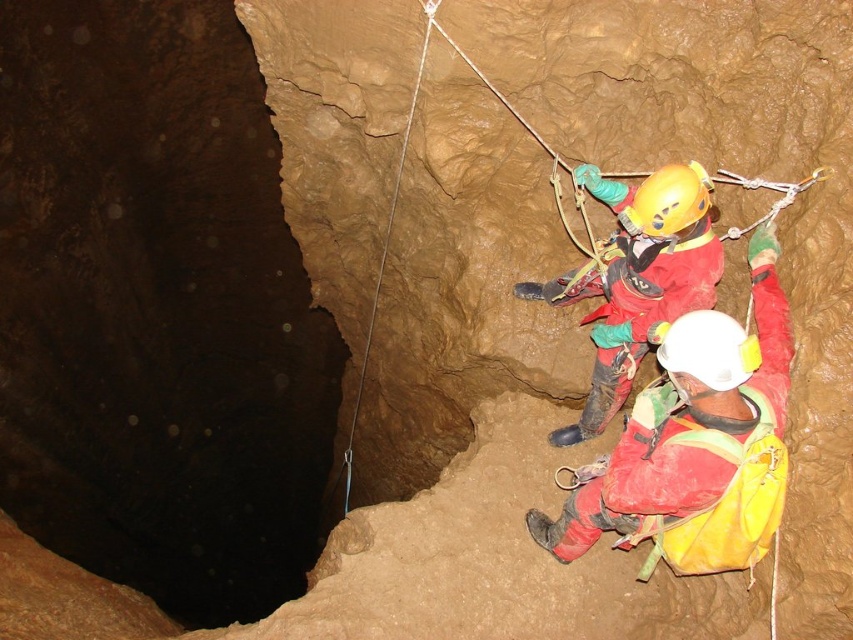
Can you confirm if red fabric helmet at center is positioned below white matte helmet at center?

Actually, red fabric helmet at center is above white matte helmet at center.

Can you confirm if red fabric helmet at center is wider than white matte helmet at center?

Correct, the width of red fabric helmet at center exceeds that of white matte helmet at center.

Is point (688, 200) positioned before point (728, 376)?

No, (688, 200) is further to viewer.

Identify the location of red fabric helmet at center. (637, 276).

What do you see at coordinates (706, 353) in the screenshot? This screenshot has height=640, width=853. I see `white matte helmet at center` at bounding box center [706, 353].

Can you confirm if white matte helmet at center is positioned to the right of yellow matte helmet at center?

No, white matte helmet at center is not to the right of yellow matte helmet at center.

Is point (750, 352) more distant than point (630, 218)?

No, (750, 352) is in front of (630, 218).

This screenshot has height=640, width=853. I want to click on white matte helmet at center, so click(706, 353).

Between red fabric helmet at center and yellow matte helmet at center, which one is positioned higher?

yellow matte helmet at center

Who is positioned more to the left, red fabric helmet at center or yellow matte helmet at center?

From the viewer's perspective, red fabric helmet at center appears more on the left side.

Is point (634, 202) positioned behind point (631, 205)?

That is False.

What are the coordinates of `red fabric helmet at center` in the screenshot? It's located at (637, 276).